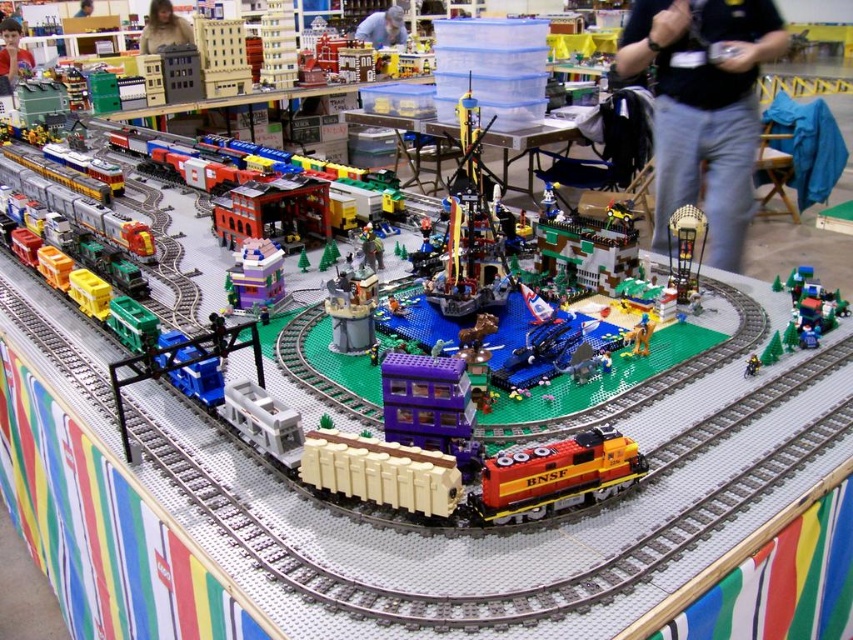
Question: Is purple plastic building at center closer to camera compared to matte beige jacket at upper left?

Choices:
 (A) yes
 (B) no

Answer: (A)

Question: Which object is closer to the camera taking this photo?

Choices:
 (A) black shirt at upper right
 (B) purple matte building at center
 (C) blue fabric shirt at center

Answer: (B)

Question: Estimate the real-world distances between objects in this image. Which object is farther from the smooth skin face at upper left?

Choices:
 (A) purple plastic building at center
 (B) matte beige jacket at upper left

Answer: (A)

Question: Which of the following is the farthest from the observer?

Choices:
 (A) smooth skin face at upper left
 (B) orange matte train at center
 (C) blue fabric shirt at center
 (D) purple plastic building at center

Answer: (C)

Question: Is smooth skin face at upper left to the left of blue fabric shirt at center from the viewer's perspective?

Choices:
 (A) no
 (B) yes

Answer: (B)

Question: Observing the image, what is the correct spatial positioning of black shirt at upper right in reference to matte beige jacket at upper left?

Choices:
 (A) left
 (B) right

Answer: (B)